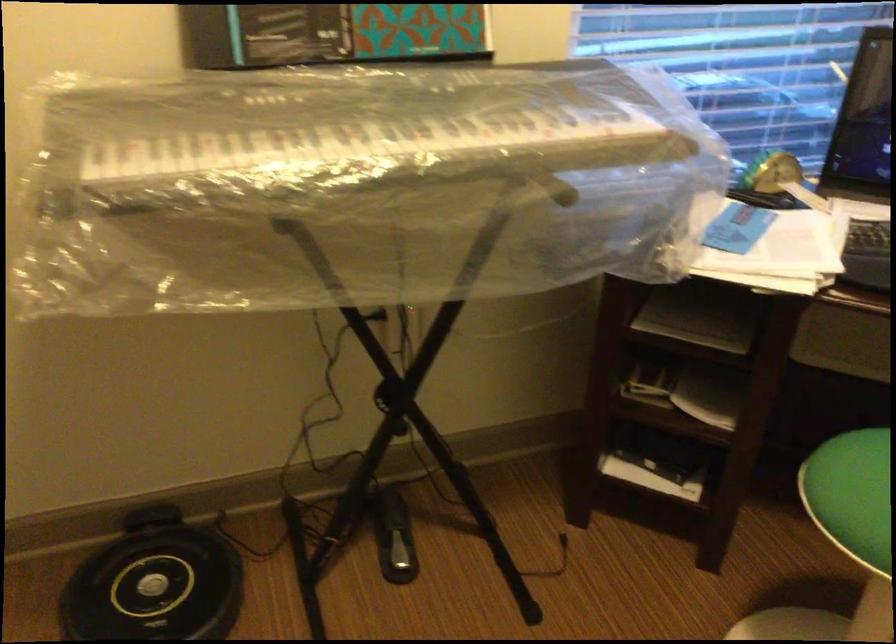
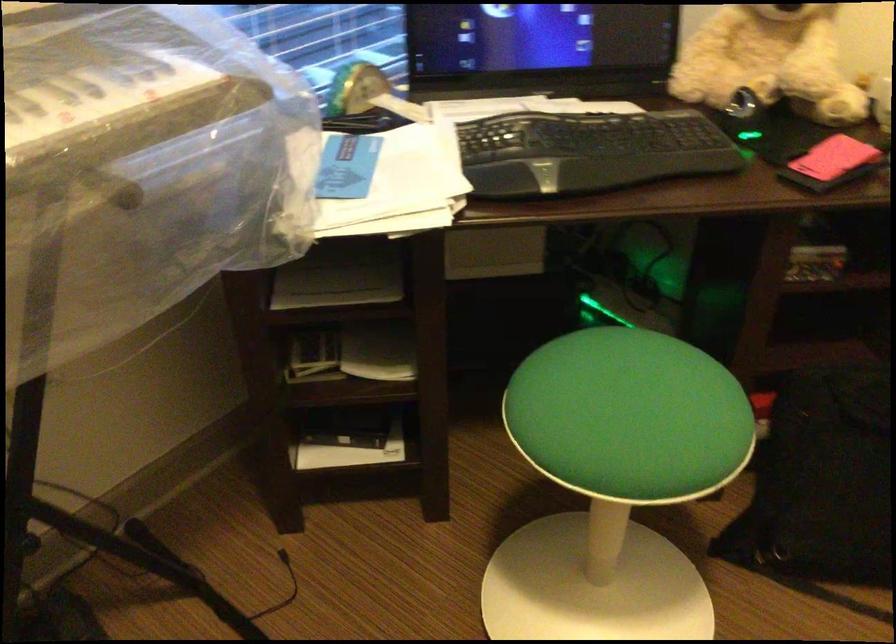
Question: The camera is either moving clockwise (left) or counter-clockwise (right) around the object. The first image is from the beginning of the video and the second image is from the end. Is the camera moving left or right when shooting the video?

Choices:
 (A) Left
 (B) Right

Answer: (A)